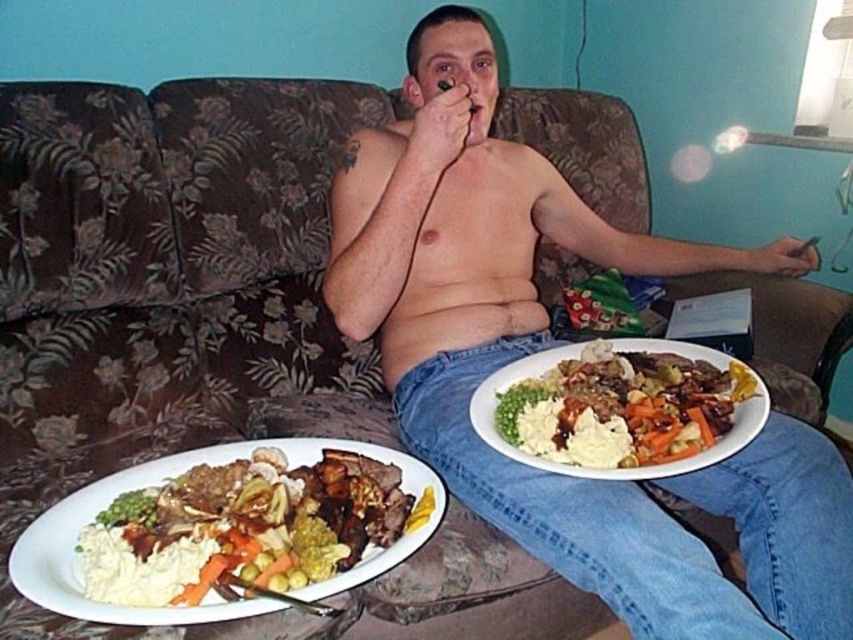
From the picture: You are a delivery person who just arrived at the apartment and see the smooth skin torso at center and the smooth white plate at lower center in the living room. Which object is higher up from the floor?

The smooth skin torso at center is located above the smooth white plate at lower center, so the smooth skin torso at center is higher up from the floor.

You are a delivery robot with a height of 12 inches. You need to place a package on the smooth skin torso at center or the smooth white plate at lower center. Which location can you reach without exceeding your height limit?

The smooth skin torso at center and smooth white plate at lower center are 7.29 inches apart from each other. Since the robot is 12 inches tall, it can reach both locations as neither is taller than the robot.